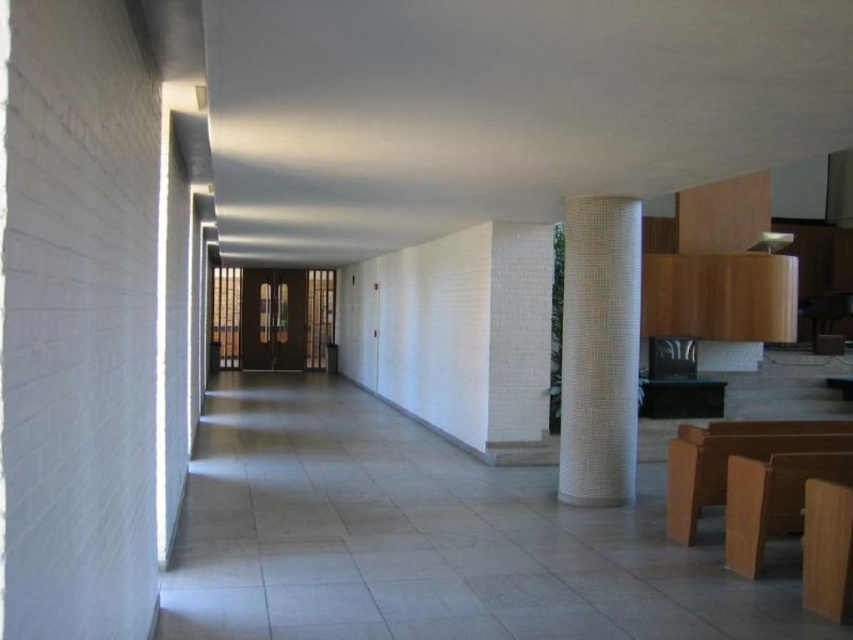
Question: Does white textured pillar at center appear over light brown wood church bench at lower right?

Choices:
 (A) no
 (B) yes

Answer: (B)

Question: Which point appears closest to the camera in this image?

Choices:
 (A) (749, 483)
 (B) (624, 328)

Answer: (A)

Question: Can you confirm if white textured pillar at center is positioned to the left of light brown wood church bench at lower right?

Choices:
 (A) no
 (B) yes

Answer: (B)

Question: Which point is farther from the camera taking this photo?

Choices:
 (A) (724, 465)
 (B) (577, 422)

Answer: (B)

Question: Is white textured pillar at center closer to camera compared to light brown wood church bench at lower right?

Choices:
 (A) yes
 (B) no

Answer: (B)